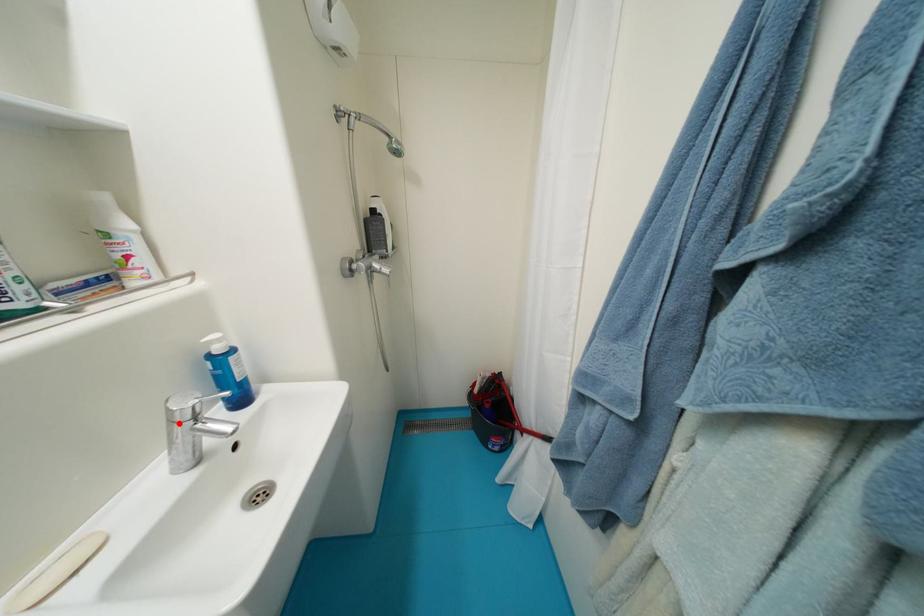
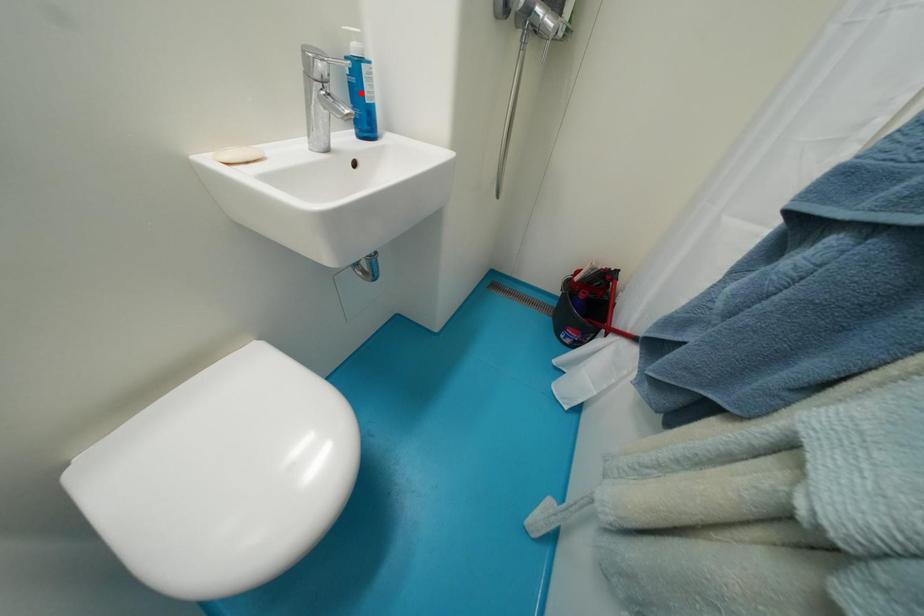
I am providing you with two images of the same scene from different viewpoints. A red point is marked on the first image and another point is marked on the second image. Does the point marked in image1 correspond to the same location as the one in image2?

No